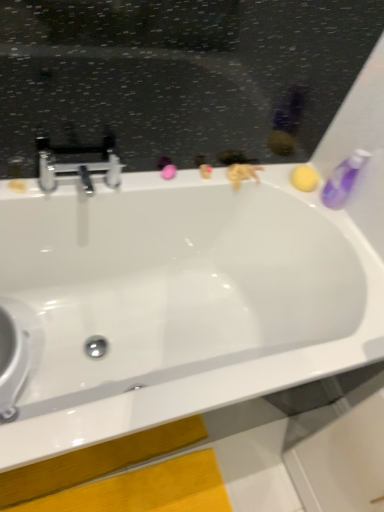
Question: From their relative heights in the image, would you say purple translucent bottle at upper right is taller or shorter than white glossy bathtub at center?

Choices:
 (A) short
 (B) tall

Answer: (A)

Question: Is purple translucent bottle at upper right spatially inside white glossy bathtub at center, or outside of it?

Choices:
 (A) inside
 (B) outside

Answer: (B)

Question: Which of these objects is positioned closest to the purple translucent bottle at upper right?

Choices:
 (A) white glossy bathtub at center
 (B) polished chrome faucet at upper left

Answer: (A)

Question: Estimate the real-world distances between objects in this image. Which object is farther from the white glossy bathtub at center?

Choices:
 (A) polished chrome faucet at upper left
 (B) purple translucent bottle at upper right

Answer: (B)